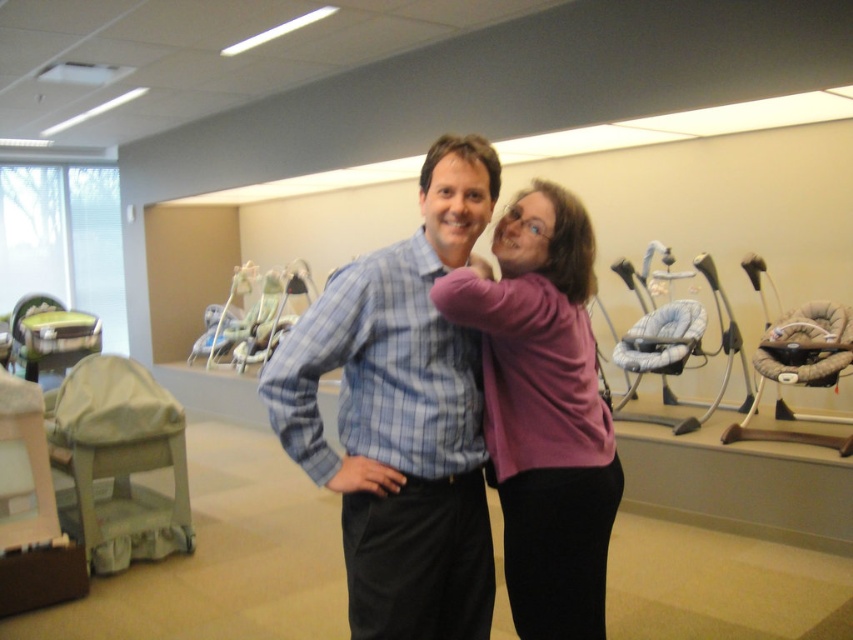
Does blue plaid shirt at center have a greater height compared to purple sweater at center?

Indeed, blue plaid shirt at center has a greater height compared to purple sweater at center.

Does blue plaid shirt at center appear over purple sweater at center?

Correct, blue plaid shirt at center is located above purple sweater at center.

The image size is (853, 640). I want to click on blue plaid shirt at center, so click(x=401, y=413).

At what (x,y) coordinates should I click in order to perform the action: click on blue plaid shirt at center. Please return your answer as a coordinate pair (x, y). Looking at the image, I should click on (401, 413).